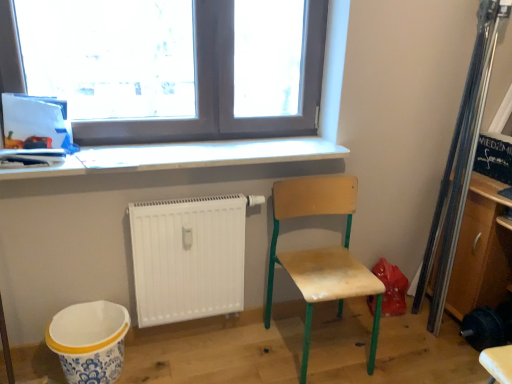
At what (x,y) coordinates should I click in order to perform the action: click on vacant space to the right of wooden chair at lower right. Please return your answer as a coordinate pair (x, y). Looking at the image, I should click on (389, 350).